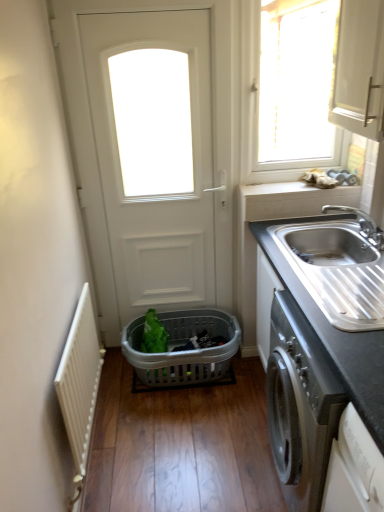
Question: Does silver metallic faucet at sink right come in front of black granite countertop at right?

Choices:
 (A) yes
 (B) no

Answer: (B)

Question: Does silver metallic faucet at sink right turn towards black granite countertop at right?

Choices:
 (A) yes
 (B) no

Answer: (B)

Question: Is silver metallic faucet at sink right oriented away from black granite countertop at right?

Choices:
 (A) yes
 (B) no

Answer: (B)

Question: Does silver metallic faucet at sink right have a greater width compared to black granite countertop at right?

Choices:
 (A) yes
 (B) no

Answer: (B)

Question: Considering the relative sizes of silver metallic faucet at sink right and black granite countertop at right in the image provided, is silver metallic faucet at sink right smaller than black granite countertop at right?

Choices:
 (A) no
 (B) yes

Answer: (B)

Question: Would you say white painted metal radiator at left is inside or outside silver metallic faucet at sink right?

Choices:
 (A) outside
 (B) inside

Answer: (A)

Question: From the image's perspective, is white painted metal radiator at left positioned above or below silver metallic faucet at sink right?

Choices:
 (A) below
 (B) above

Answer: (A)

Question: Does point (79, 431) appear closer or farther from the camera than point (362, 216)?

Choices:
 (A) closer
 (B) farther

Answer: (A)

Question: Considering the positions of white painted metal radiator at left and silver metallic faucet at sink right in the image, is white painted metal radiator at left taller or shorter than silver metallic faucet at sink right?

Choices:
 (A) short
 (B) tall

Answer: (B)

Question: Based on their sizes in the image, would you say gray plastic basket at center is bigger or smaller than stainless steel sink at right?

Choices:
 (A) small
 (B) big

Answer: (B)

Question: In terms of width, does gray plastic basket at center look wider or thinner when compared to stainless steel sink at right?

Choices:
 (A) thin
 (B) wide

Answer: (B)

Question: Is gray plastic basket at center inside the boundaries of stainless steel sink at right, or outside?

Choices:
 (A) inside
 (B) outside

Answer: (B)

Question: From a real-world perspective, is gray plastic basket at center positioned above or below stainless steel sink at right?

Choices:
 (A) below
 (B) above

Answer: (A)

Question: From a real-world perspective, is white plastic window at upper right physically located above or below white painted metal radiator at left?

Choices:
 (A) above
 (B) below

Answer: (A)

Question: Is point (254, 89) positioned closer to the camera than point (81, 362)?

Choices:
 (A) farther
 (B) closer

Answer: (A)